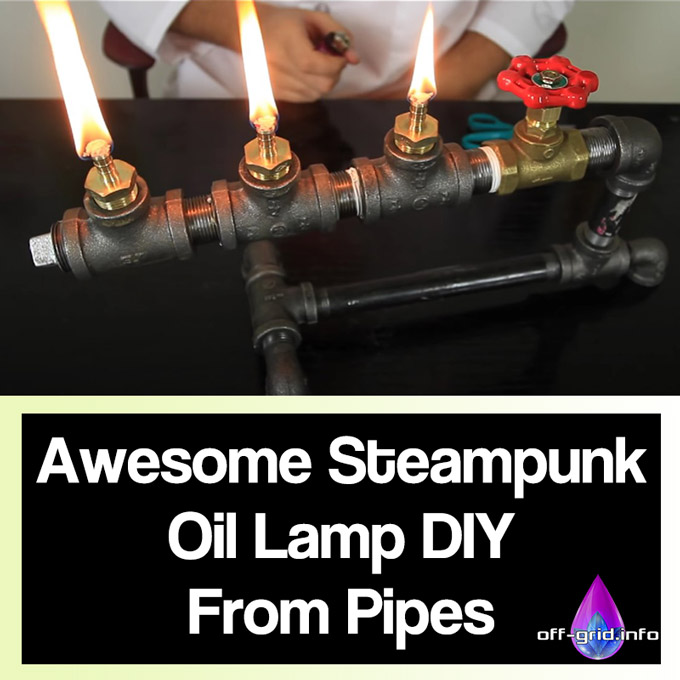
I want to click on brass fitting, so click(x=528, y=173), click(x=408, y=141), click(x=247, y=160), click(x=126, y=197).